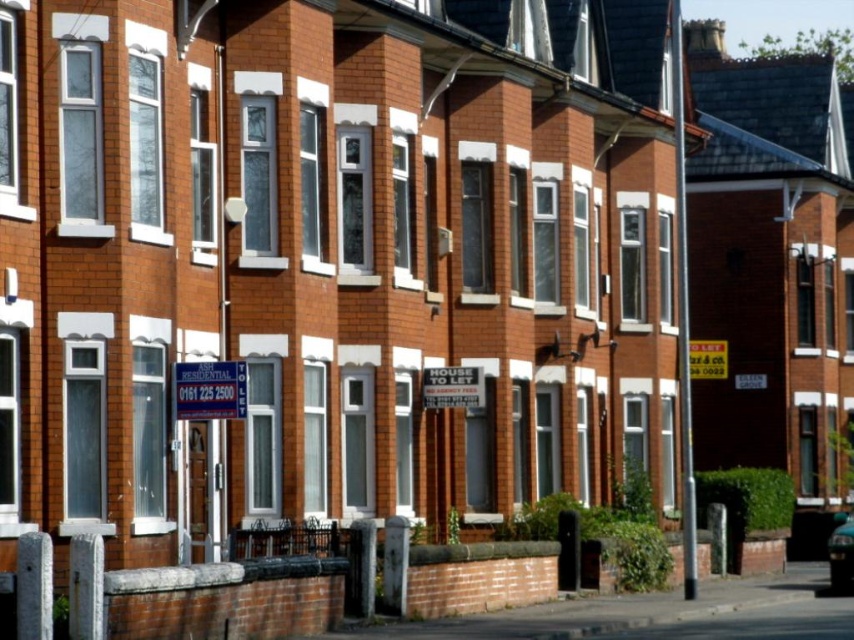
You are a delivery driver approaching the street where the terraced houses are located. You see a blue plastic sign at center and a metallic blue car at lower right. Which object is above the other?

The blue plastic sign at center is positioned over the metallic blue car at lower right, meaning it is above the car.

You are a delivery driver approaching the street in front of the terraced houses. You see a blue plastic sign at center and a metallic blue car at lower right. Which object is shorter in height?

The blue plastic sign at center has a lesser height compared to the metallic blue car at lower right, so the blue plastic sign at center is shorter.

You are a delivery person trying to find the correct address. You see a blue plastic sign at center and a metallic blue car at lower right. Which object is closer to the row of terraced houses?

The blue plastic sign at center is closer to the row of terraced houses than the metallic blue car at lower right because it has a smaller size compared to the car, indicating it is nearer.